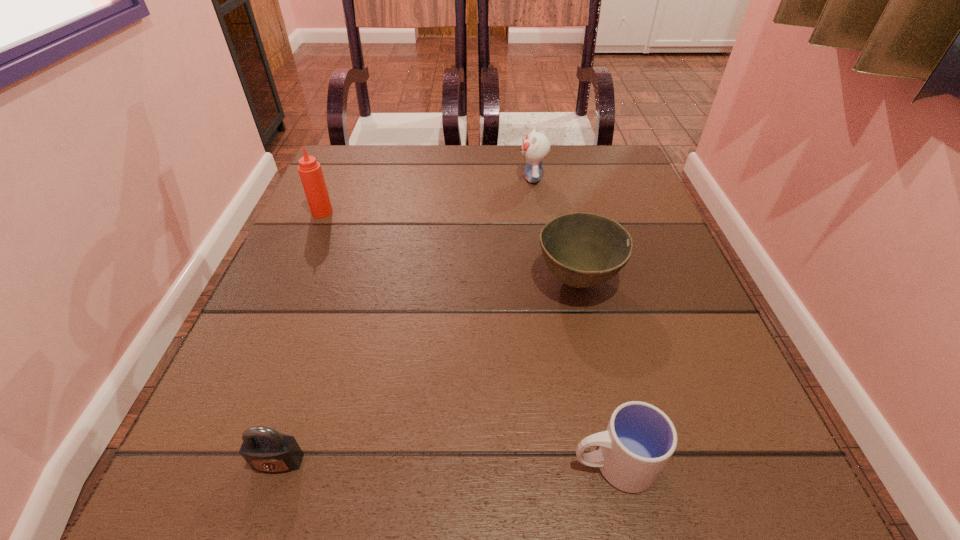
At what (x,y) coordinates should I click in order to perform the action: click on free space between the farthest object and the leftmost object. Please return your answer as a coordinate pair (x, y). This screenshot has height=540, width=960. Looking at the image, I should click on (427, 195).

In order to click on vacant area between the kitten and the second object from left to right in this screenshot , I will do click(405, 320).

Identify which object is the fourth nearest to the bowl. Please provide its 2D coordinates. Your answer should be formatted as a tuple, i.e. [(x, y)], where the tuple contains the x and y coordinates of a point satisfying the conditions above.

[(311, 175)]

Locate an element on the screen. The width and height of the screenshot is (960, 540). object that is the fourth nearest to the tallest object is located at coordinates (640, 439).

Image resolution: width=960 pixels, height=540 pixels. I want to click on free point that satisfies the following two spatial constraints: 1. on the front-facing side of the third nearest object; 2. on the right side of the kitten, so click(x=548, y=281).

Locate an element on the screen. This screenshot has width=960, height=540. vacant space that satisfies the following two spatial constraints: 1. on the front-facing side of the bowl; 2. on the right side of the fourth shortest object is located at coordinates (548, 281).